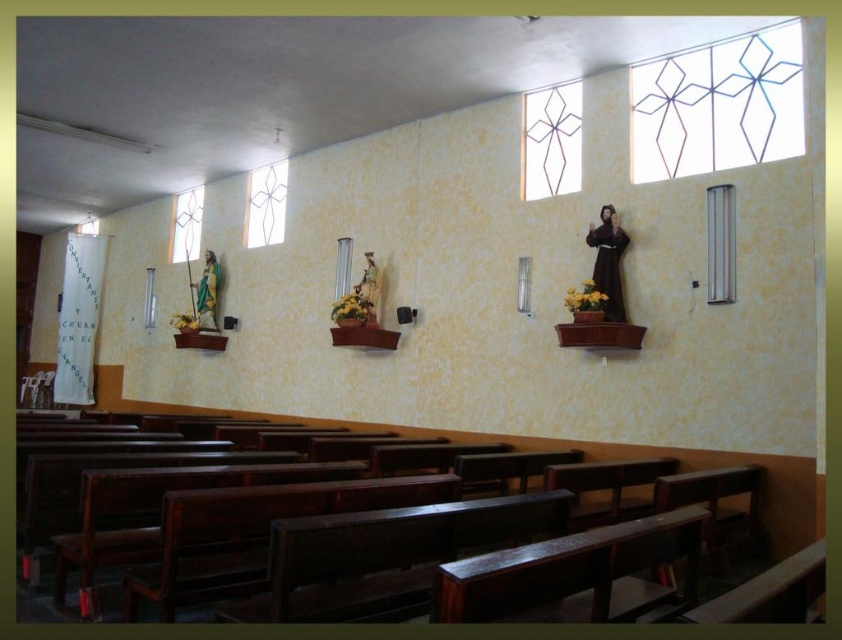
Does clear glass cross at upper center have a lesser width compared to clear glass window at center?

Incorrect, clear glass cross at upper center's width is not less than clear glass window at center's.

Measure the distance between point (576, 84) and camera.

Point (576, 84) is 22.63 feet from camera.

I want to click on clear glass cross at upper center, so click(552, 141).

Is clear glass window at upper center wider than clear glass window at upper left?

No, clear glass window at upper center is not wider than clear glass window at upper left.

Between clear glass window at upper center and clear glass window at upper left, which one appears on the left side from the viewer's perspective?

clear glass window at upper left

Which is in front, point (254, 204) or point (201, 193)?

Point (254, 204) is in front.

You are a GUI agent. You are given a task and a screenshot of the screen. Output one action in this format:
    pyautogui.click(x=<x>, y=<y>)
    Task: Click on the clear glass window at upper center
    
    Given the screenshot: What is the action you would take?
    pyautogui.click(x=265, y=204)

Does dark brown wood church bench at lower left come in front of clear glass window at upper left?

That is True.

Consider the image. Who is shorter, dark brown wood church bench at lower left or clear glass window at upper left?

dark brown wood church bench at lower left

Where is `dark brown wood church bench at lower left`? The width and height of the screenshot is (842, 640). dark brown wood church bench at lower left is located at coordinates (681, 465).

I want to click on dark brown wood church bench at lower left, so click(x=681, y=465).